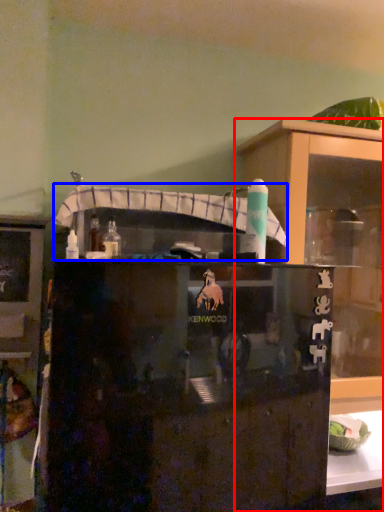
Question: Among these objects, which one is nearest to the camera, cupboard (highlighted by a red box) or shelf (highlighted by a blue box)?

Choices:
 (A) cupboard
 (B) shelf

Answer: (B)